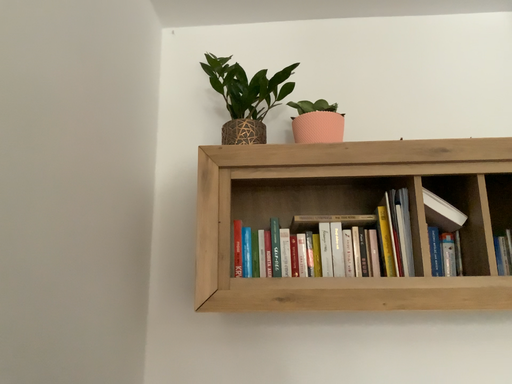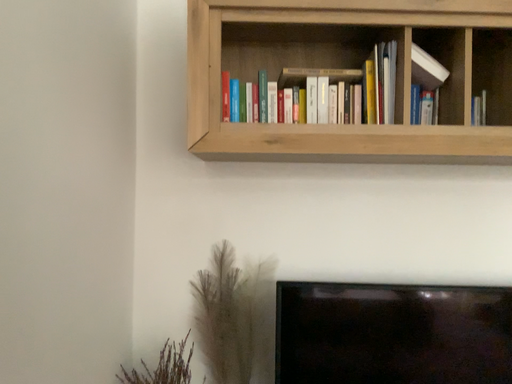
Question: How did the camera likely rotate when shooting the video?

Choices:
 (A) rotated upward
 (B) rotated downward

Answer: (B)